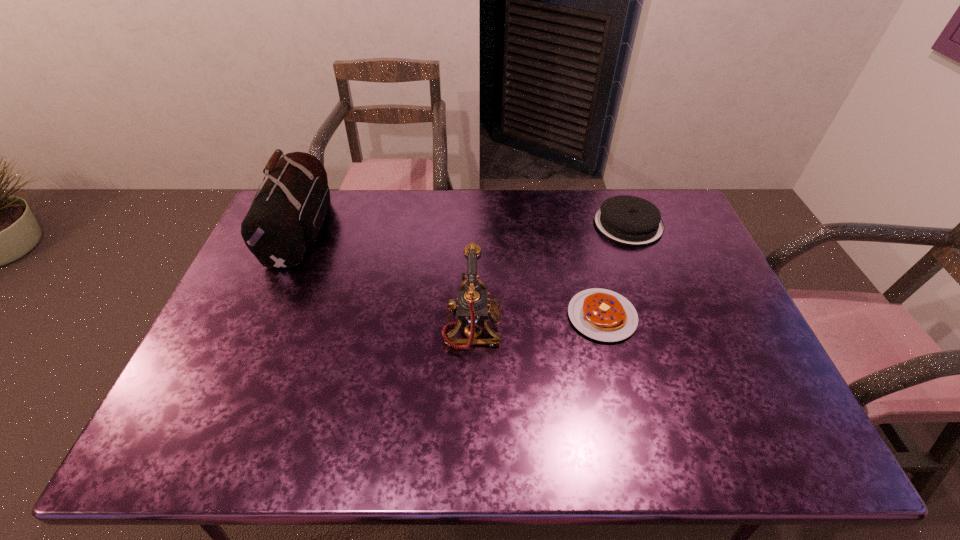
What are the coordinates of `object that ranks as the third closest to the second object from left to right` in the screenshot? It's located at (285, 218).

Select which object appears as the third closest to the leftmost object. Please provide its 2D coordinates. Your answer should be formatted as a tuple, i.e. [(x, y)], where the tuple contains the x and y coordinates of a point satisfying the conditions above.

[(628, 220)]

You are a GUI agent. You are given a task and a screenshot of the screen. Output one action in this format:
    pyautogui.click(x=<x>, y=<y>)
    Task: Click on the free location that satisfies the following two spatial constraints: 1. on the front side of the third tallest object; 2. on the front of the third object from right to left, featuring the rotary dial
    The width and height of the screenshot is (960, 540).
    Given the screenshot: What is the action you would take?
    pyautogui.click(x=666, y=328)

Where is `vacant region that satisfies the following two spatial constraints: 1. on the front side of the third tallest object; 2. on the front pocket of the duffel bag`? This screenshot has width=960, height=540. vacant region that satisfies the following two spatial constraints: 1. on the front side of the third tallest object; 2. on the front pocket of the duffel bag is located at coordinates (631, 230).

Locate an element on the screen. The width and height of the screenshot is (960, 540). free location that satisfies the following two spatial constraints: 1. on the front pocket of the duffel bag; 2. on the left side of the nearer pancake is located at coordinates (264, 316).